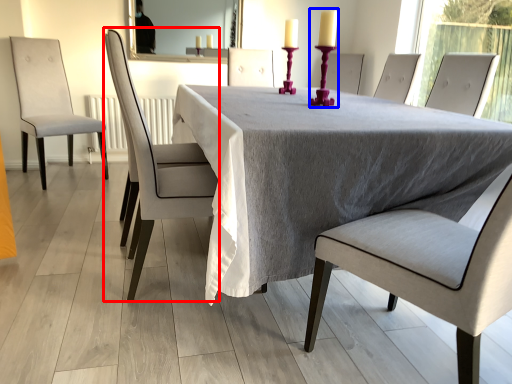
Question: Among these objects, which one is nearest to the camera, chair (highlighted by a red box) or candle holder (highlighted by a blue box)?

Choices:
 (A) chair
 (B) candle holder

Answer: (B)